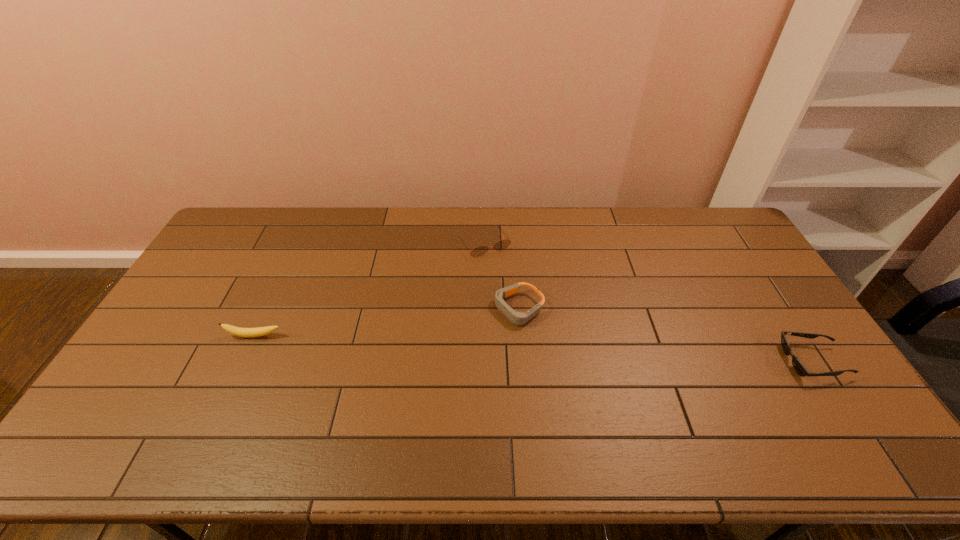
Image resolution: width=960 pixels, height=540 pixels. In the image, there is a desktop. Identify the location of blank space at the near edge. (539, 397).

Find the location of a particular element. The image size is (960, 540). vacant area at the left edge of the desktop is located at coordinates (164, 362).

Where is `free space at the right edge`? This screenshot has height=540, width=960. free space at the right edge is located at coordinates (762, 299).

This screenshot has height=540, width=960. In the image, there is a desktop. What are the coordinates of `vacant space at the far left corner` in the screenshot? It's located at (251, 233).

Locate an element on the screen. The width and height of the screenshot is (960, 540). empty location between the left sunglasses and the nearest object is located at coordinates (649, 302).

This screenshot has height=540, width=960. What are the coordinates of `vacant area that lies between the goggles and the farther sunglasses` in the screenshot? It's located at (502, 276).

Where is `vacant space that's between the rightmost object and the goggles`? This screenshot has height=540, width=960. vacant space that's between the rightmost object and the goggles is located at coordinates (666, 335).

Find the location of a particular element. This screenshot has height=540, width=960. vacant space in between the goggles and the second nearest object is located at coordinates (387, 322).

Where is `vacant point located between the farther sunglasses and the second nearest object`? The width and height of the screenshot is (960, 540). vacant point located between the farther sunglasses and the second nearest object is located at coordinates (370, 290).

I want to click on unoccupied area between the right sunglasses and the left sunglasses, so click(x=649, y=302).